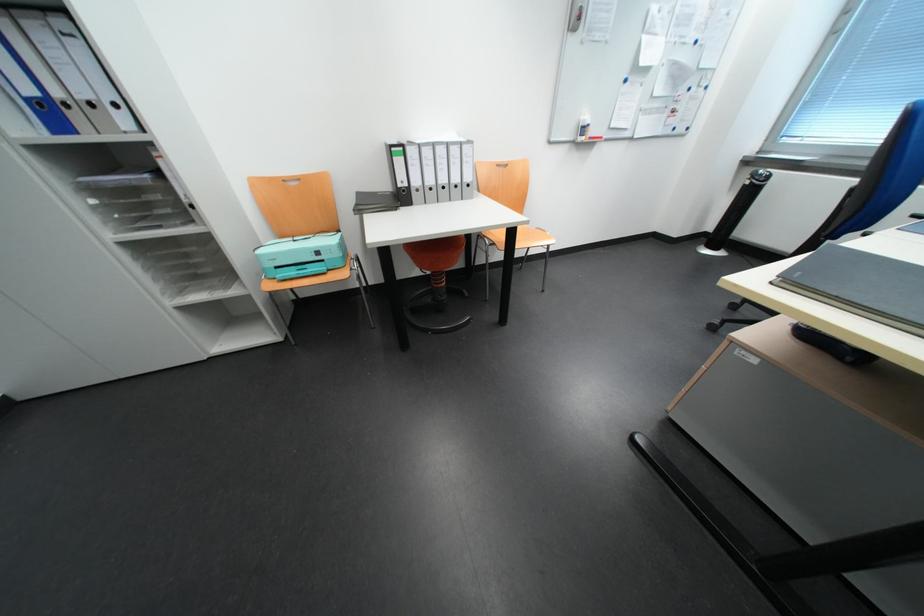
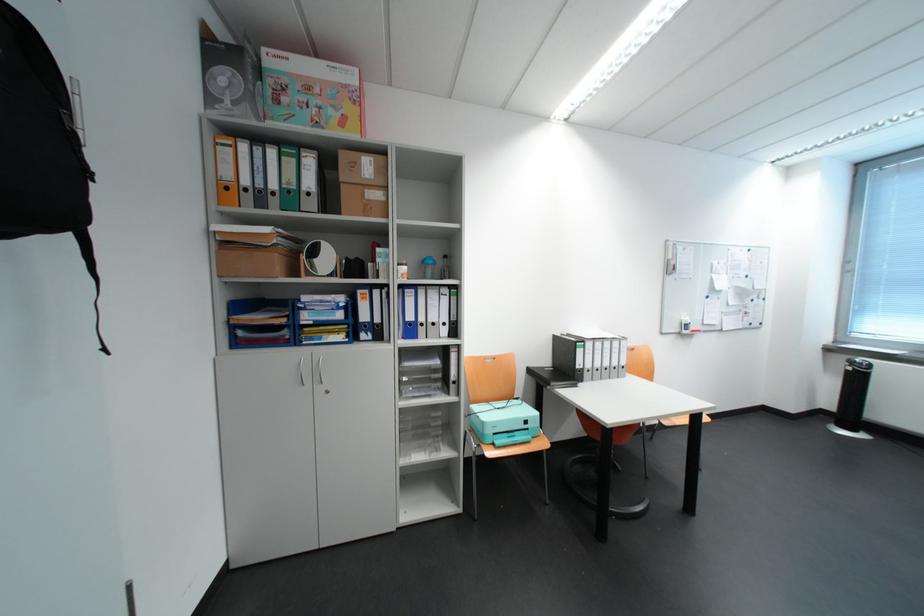
In the second image, find the point that corresponds to (38,102) in the first image.

(417, 323)